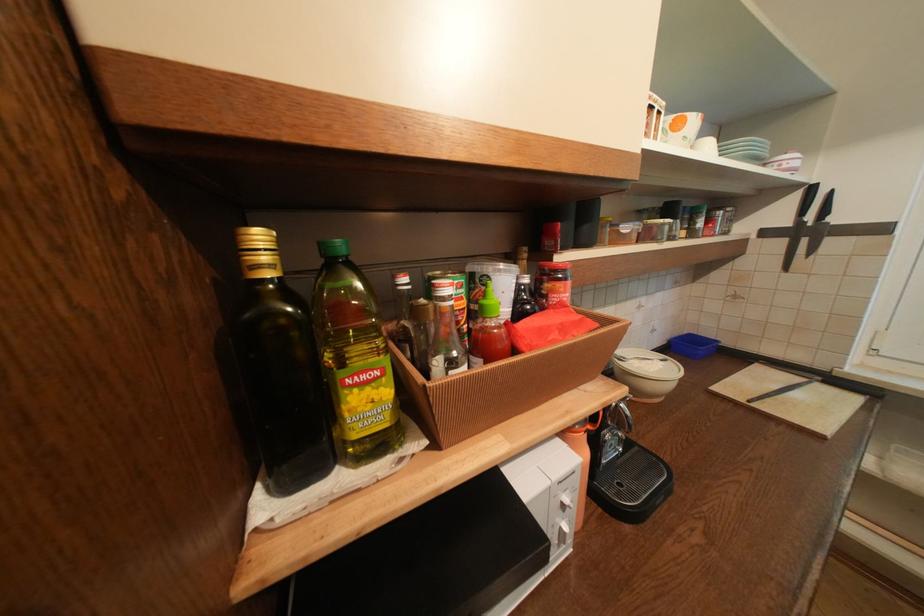
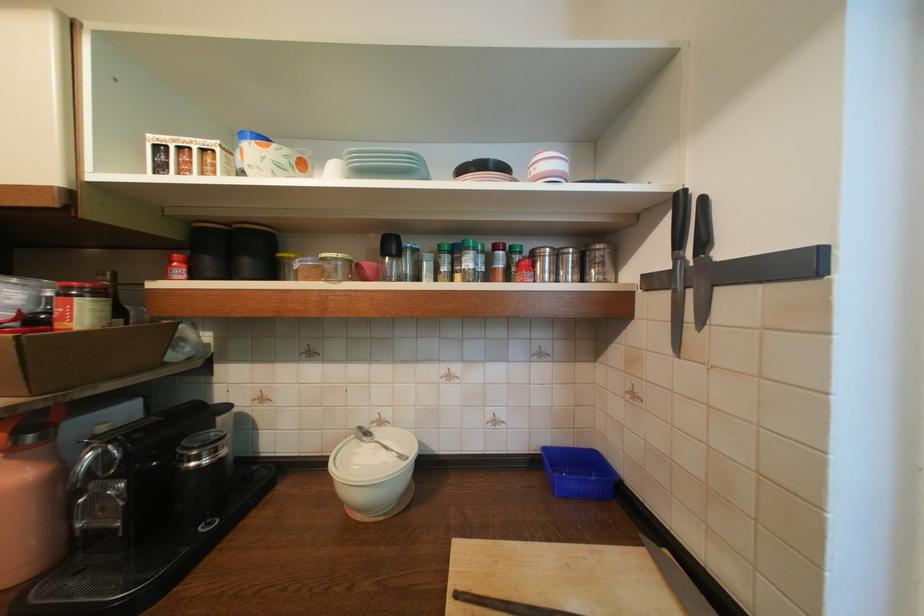
Find the pixel in the second image that matches the point at 568,276 in the first image.

(82, 294)